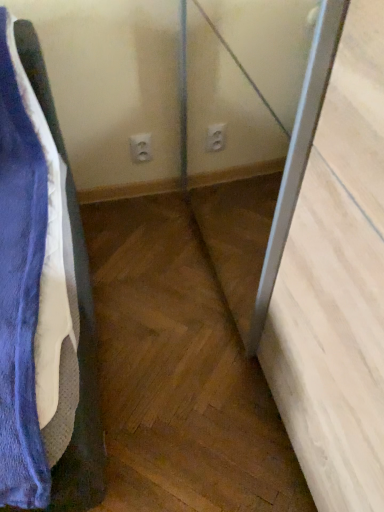
What do you see at coordinates (141, 147) in the screenshot? The height and width of the screenshot is (512, 384). I see `white plastic electric outlet at center` at bounding box center [141, 147].

The height and width of the screenshot is (512, 384). Identify the location of white plastic electric outlet at center. (141, 147).

Describe the element at coordinates (252, 133) in the screenshot. The height and width of the screenshot is (512, 384). I see `clear glass screen door at center` at that location.

This screenshot has height=512, width=384. What are the coordinates of `clear glass screen door at center` in the screenshot? It's located at (252, 133).

This screenshot has width=384, height=512. I want to click on white plastic electric outlet at center, so click(x=141, y=147).

Does clear glass screen door at center appear on the left side of white plastic electric outlet at center?

No, clear glass screen door at center is not to the left of white plastic electric outlet at center.

Considering the positions of objects clear glass screen door at center and white plastic electric outlet at center in the image provided, who is behind, clear glass screen door at center or white plastic electric outlet at center?

white plastic electric outlet at center is further from the camera.

Considering the points (289, 189) and (145, 139), which point is behind, point (289, 189) or point (145, 139)?

The point (145, 139) is behind.

From the image's perspective, between clear glass screen door at center and white plastic electric outlet at center, who is located below?

From the image's view, clear glass screen door at center is below.

From a real-world perspective, is clear glass screen door at center positioned over white plastic electric outlet at center based on gravity?

Yes.

Is clear glass screen door at center thinner than white plastic electric outlet at center?

Incorrect, the width of clear glass screen door at center is not less than that of white plastic electric outlet at center.

Looking at this image, can you confirm if clear glass screen door at center is shorter than white plastic electric outlet at center?

No, clear glass screen door at center is not shorter than white plastic electric outlet at center.

Considering the relative sizes of clear glass screen door at center and white plastic electric outlet at center in the image provided, is clear glass screen door at center bigger than white plastic electric outlet at center?

Yes.

Is white plastic electric outlet at center completely or partially inside clear glass screen door at center?

No.

Is clear glass screen door at center with white plastic electric outlet at center?

They are not placed beside each other.

Does clear glass screen door at center turn towards white plastic electric outlet at center?

Yes, clear glass screen door at center is facing white plastic electric outlet at center.

How different are the orientations of clear glass screen door at center and white plastic electric outlet at center in degrees?

The angular difference between clear glass screen door at center and white plastic electric outlet at center is 86.5 degrees.

What are the coordinates of `electric outlet behind the clear glass screen door at center` in the screenshot? It's located at (141, 147).

Is white plastic electric outlet at center to the right of clear glass screen door at center from the viewer's perspective?

No, white plastic electric outlet at center is not to the right of clear glass screen door at center.

Which object is more forward, white plastic electric outlet at center or clear glass screen door at center?

clear glass screen door at center is more forward.

Considering the positions of point (149, 149) and point (283, 64), is point (149, 149) closer or farther from the camera than point (283, 64)?

Point (149, 149).

From the image's perspective, would you say white plastic electric outlet at center is shown under clear glass screen door at center?

No.

From a real-world perspective, which is physically above, white plastic electric outlet at center or clear glass screen door at center?

From a 3D spatial view, clear glass screen door at center is above.

Considering the sizes of objects white plastic electric outlet at center and clear glass screen door at center in the image provided, who is wider, white plastic electric outlet at center or clear glass screen door at center?

Wider between the two is clear glass screen door at center.

Between white plastic electric outlet at center and clear glass screen door at center, which one has less height?

Standing shorter between the two is white plastic electric outlet at center.

Considering the sizes of objects white plastic electric outlet at center and clear glass screen door at center in the image provided, who is bigger, white plastic electric outlet at center or clear glass screen door at center?

clear glass screen door at center.

Is clear glass screen door at center completely or partially inside white plastic electric outlet at center?

No.

Is there a large distance between white plastic electric outlet at center and clear glass screen door at center?

No, white plastic electric outlet at center is not far from clear glass screen door at center.

Is white plastic electric outlet at center looking in the opposite direction of clear glass screen door at center?

white plastic electric outlet at center does not have its back to clear glass screen door at center.

How much distance is there between white plastic electric outlet at center and clear glass screen door at center?

The distance of white plastic electric outlet at center from clear glass screen door at center is 18.01 inches.

The height and width of the screenshot is (512, 384). I want to click on electric outlet behind the clear glass screen door at center, so click(141, 147).

Where is `screen door on the right of the white plastic electric outlet at center`? The width and height of the screenshot is (384, 512). screen door on the right of the white plastic electric outlet at center is located at coordinates (252, 133).

Image resolution: width=384 pixels, height=512 pixels. In order to click on screen door that is below the white plastic electric outlet at center (from the image's perspective) in this screenshot , I will do `click(252, 133)`.